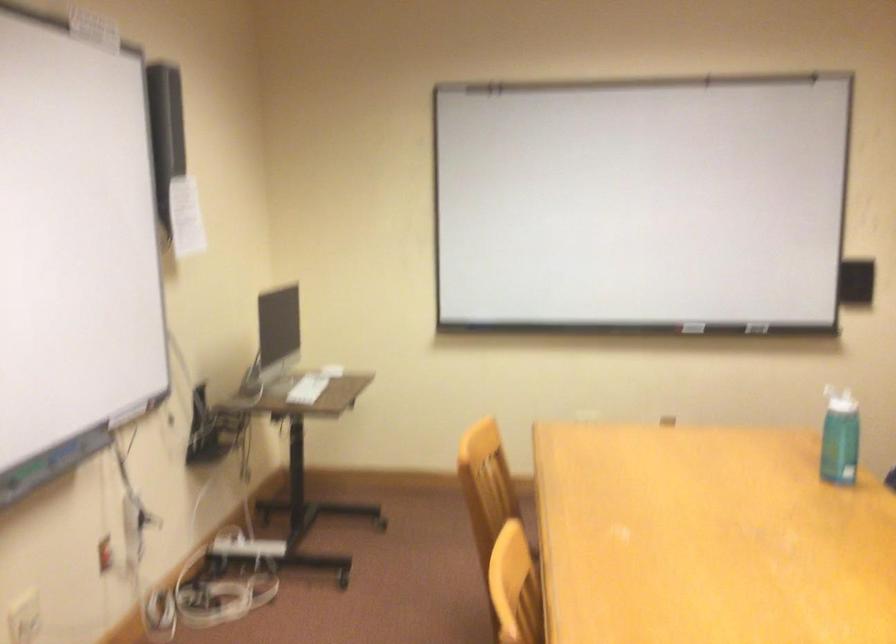
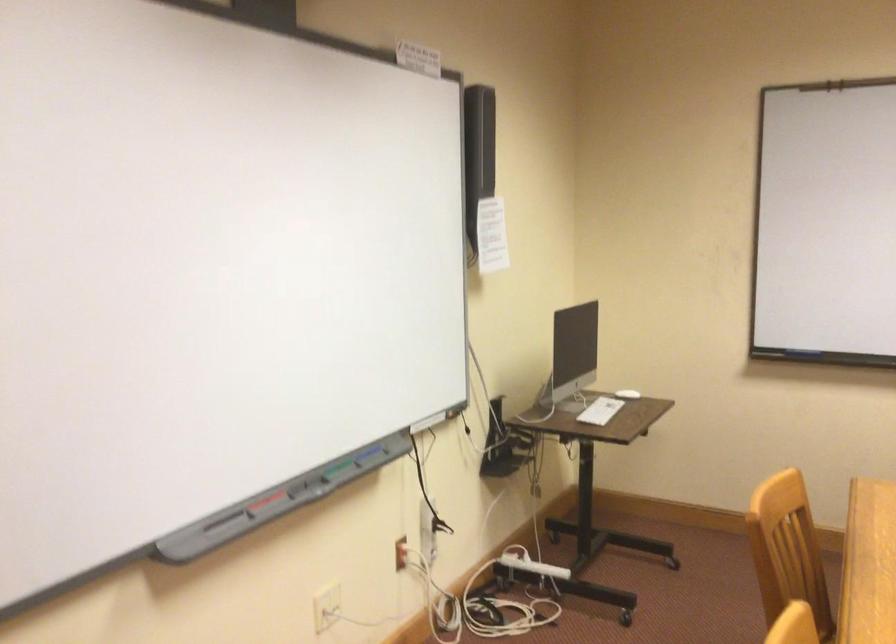
Where in the second image is the point corresponding to point 255,550 from the first image?

(530, 564)